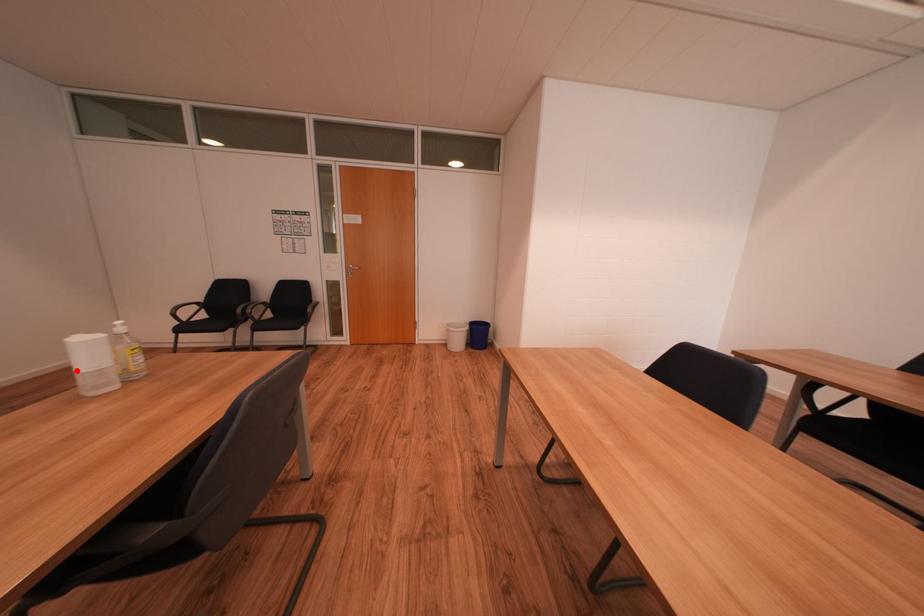
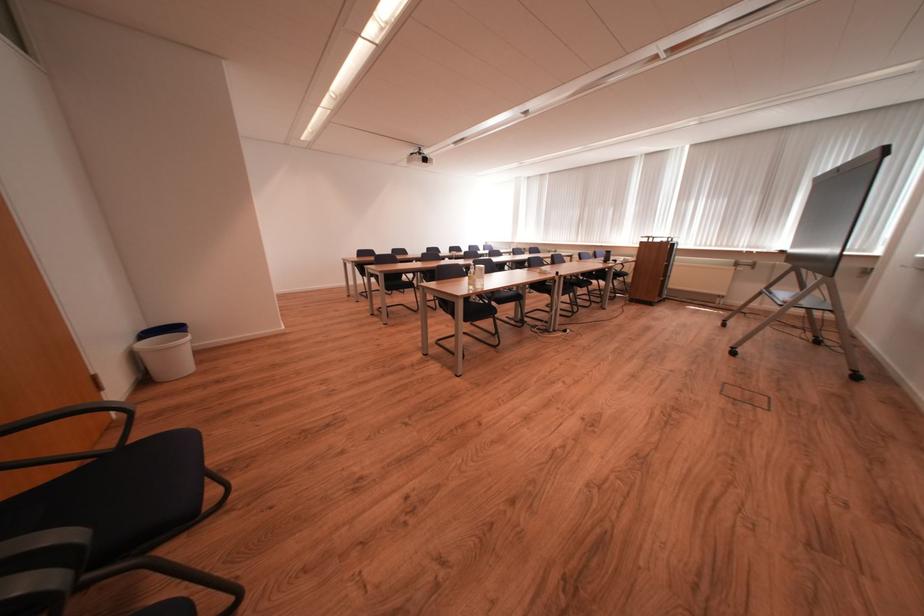
Question: I am providing you with two images of the same scene from different viewpoints. A red point is marked on the first image. At the location where the point appears in image 1, is it still visible in image 2?

Choices:
 (A) Yes
 (B) No

Answer: (B)